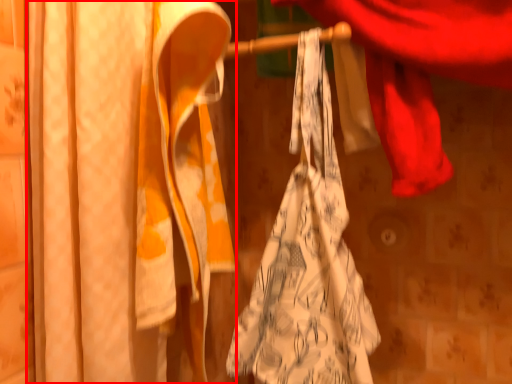
Question: From the image's perspective, where is curtain (annotated by the red box) located relative to towel?

Choices:
 (A) below
 (B) above

Answer: (B)